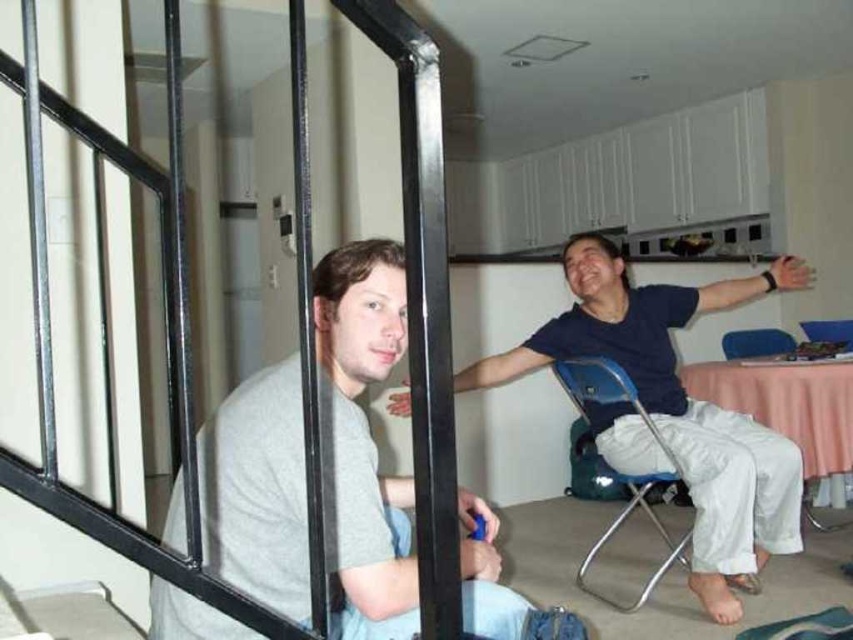
Consider the image. You are a delivery person who needs to place a small package between the gray matte shirt at left and the blue cotton shirt at center. The package is 2 feet long. Can you fit it between them without moving either shirt?

The gray matte shirt at left and blue cotton shirt at center are 4.61 feet apart, so yes, the 2 feet long package can fit between them since the distance is greater than the package length.

You are standing in the studio and want to place a small decoration exactly halfway between point (767, 438) and point (614, 525). Which point is closer to the decoration?

Point (767, 438) is closer to the decoration because it is closer to the camera than point (614, 525).